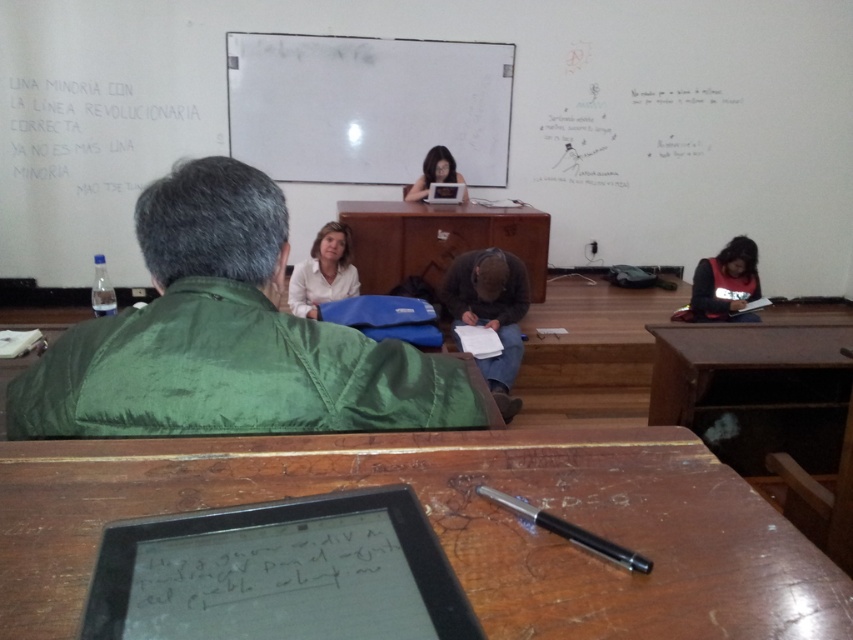
Does brown wooden table at center have a greater width compared to dark blue fabric jacket at right?

Indeed, brown wooden table at center has a greater width compared to dark blue fabric jacket at right.

Consider the image. Who is lower down, brown wooden table at center or dark blue fabric jacket at right?

dark blue fabric jacket at right is below.

The image size is (853, 640). Find the location of `brown wooden table at center`. brown wooden table at center is located at coordinates (439, 240).

Between point (292, 282) and point (436, 148), which one is positioned in front?

Positioned in front is point (292, 282).

Which is in front, point (312, 316) or point (427, 182)?

Positioned in front is point (312, 316).

At what (x,y) coordinates should I click in order to perform the action: click on white matte shirt at center. Please return your answer as a coordinate pair (x, y). This screenshot has width=853, height=640. Looking at the image, I should click on (323, 272).

Is the position of brown wooden table at center more distant than that of black metallic pen at center?

Yes, brown wooden table at center is further from the viewer.

Can you confirm if brown wooden table at center is shorter than black metallic pen at center?

No, brown wooden table at center is not shorter than black metallic pen at center.

Is point (457, 236) closer to camera compared to point (628, 554)?

No.

Find the location of a particular element. The height and width of the screenshot is (640, 853). brown wooden table at center is located at coordinates (439, 240).